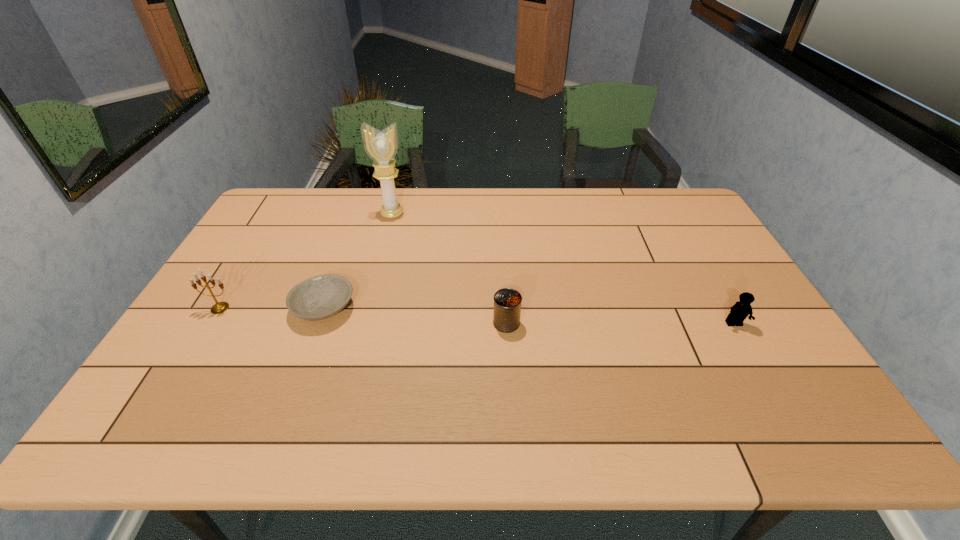
Find the location of `vacant area that lies between the Lego and the shortest object`. vacant area that lies between the Lego and the shortest object is located at coordinates (529, 316).

Locate an element on the screen. The height and width of the screenshot is (540, 960). object that ranks as the fourth closest to the rightmost object is located at coordinates (218, 308).

Choose which object is the second nearest neighbor to the candelabrum. Please provide its 2D coordinates. Your answer should be formatted as a tuple, i.e. [(x, y)], where the tuple contains the x and y coordinates of a point satisfying the conditions above.

[(381, 146)]

You are a GUI agent. You are given a task and a screenshot of the screen. Output one action in this format:
    pyautogui.click(x=<x>, y=<y>)
    Task: Click on the vacant area that satisfies the following two spatial constraints: 1. on the front-facing side of the can; 2. on the right side of the farthest object
    The height and width of the screenshot is (540, 960).
    Given the screenshot: What is the action you would take?
    pyautogui.click(x=364, y=323)

Where is `free space in the image that satisfies the following two spatial constraints: 1. on the front-facing side of the farthest object; 2. on the left side of the can`? The image size is (960, 540). free space in the image that satisfies the following two spatial constraints: 1. on the front-facing side of the farthest object; 2. on the left side of the can is located at coordinates (364, 323).